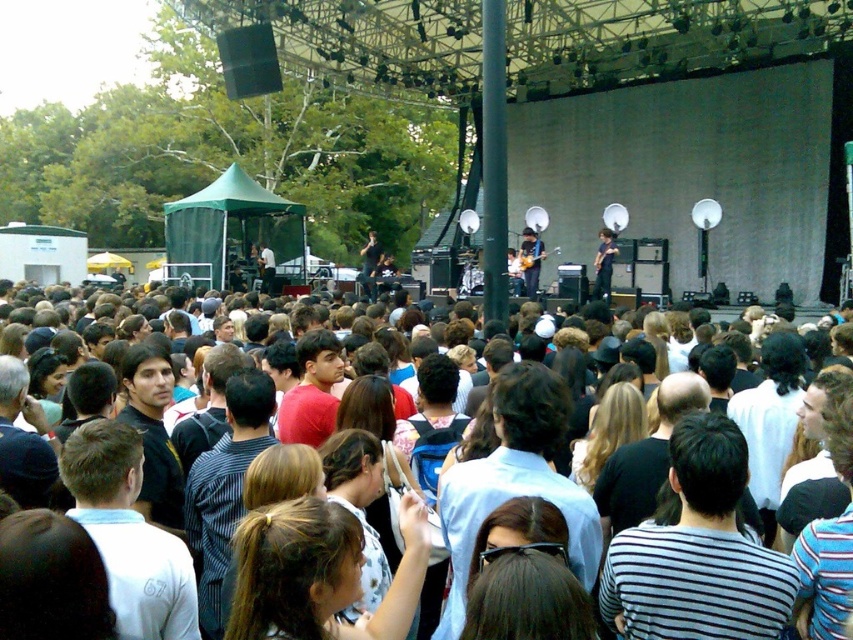
Who is taller, striped cotton shirt at center or white cotton shirt at lower left?

With more height is striped cotton shirt at center.

This screenshot has width=853, height=640. In order to click on striped cotton shirt at center in this screenshot , I will do `click(698, 552)`.

Can you confirm if multicolored casual clothing at center is positioned above striped shirt at center?

Indeed, multicolored casual clothing at center is positioned over striped shirt at center.

Consider the image. Can you confirm if multicolored casual clothing at center is taller than striped shirt at center?

Yes, multicolored casual clothing at center is taller than striped shirt at center.

Where is `multicolored casual clothing at center`? The image size is (853, 640). multicolored casual clothing at center is located at coordinates (196, 506).

Between striped cotton shirt at center and dark gray shirt at center, which one appears on the right side from the viewer's perspective?

striped cotton shirt at center

Can you confirm if striped cotton shirt at center is bigger than dark gray shirt at center?

Incorrect, striped cotton shirt at center is not larger than dark gray shirt at center.

Where is `striped cotton shirt at center`? striped cotton shirt at center is located at coordinates (698, 552).

You are a GUI agent. You are given a task and a screenshot of the screen. Output one action in this format:
    pyautogui.click(x=<x>, y=<y>)
    Task: Click on the striped cotton shirt at center
    The width and height of the screenshot is (853, 640).
    Given the screenshot: What is the action you would take?
    pyautogui.click(x=698, y=552)